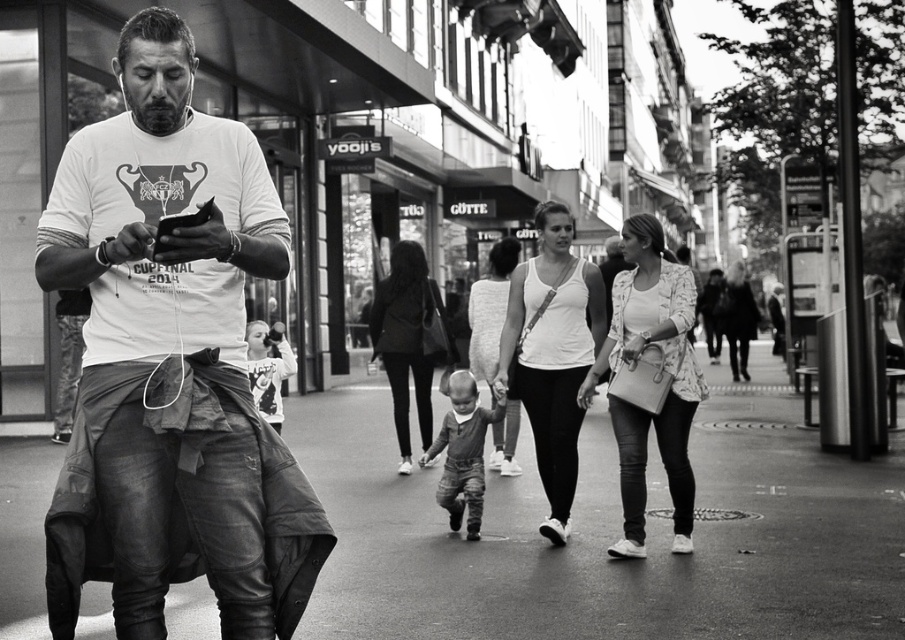
Is point (699, 486) farther from camera compared to point (532, 404)?

That is True.

Is smooth asphalt at center thinner than matte white tank top at center?

No, smooth asphalt at center is not thinner than matte white tank top at center.

Identify the location of smooth asphalt at center. The height and width of the screenshot is (640, 905). (610, 532).

Does smooth asphalt at center appear under light brown textured pants at center?

Correct, smooth asphalt at center is located below light brown textured pants at center.

Which is behind, point (599, 621) or point (458, 433)?

The point (458, 433) is behind.

This screenshot has width=905, height=640. Identify the location of smooth asphalt at center. (610, 532).

Can you confirm if white t-shirt at center is positioned above light brown textured pants at center?

Yes, white t-shirt at center is above light brown textured pants at center.

Which is above, white t-shirt at center or light brown textured pants at center?

white t-shirt at center

This screenshot has width=905, height=640. What do you see at coordinates (170, 362) in the screenshot?
I see `white t-shirt at center` at bounding box center [170, 362].

At what (x,y) coordinates should I click in order to perform the action: click on white t-shirt at center. Please return your answer as a coordinate pair (x, y). The height and width of the screenshot is (640, 905). Looking at the image, I should click on (170, 362).